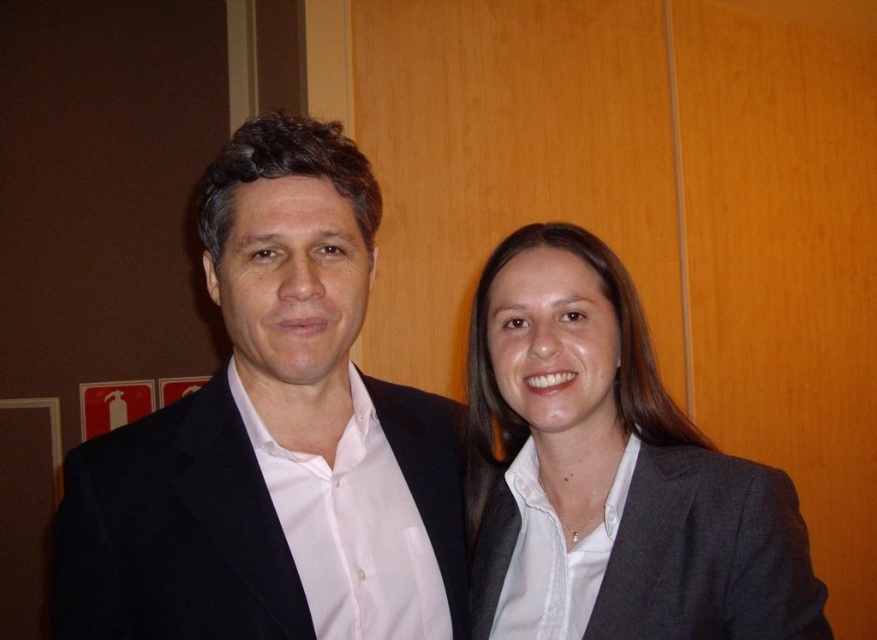
Can you confirm if matte gray blazer at right is bigger than gray fabric business suit at center?

Yes, matte gray blazer at right is bigger than gray fabric business suit at center.

Between point (811, 614) and point (639, 634), which one is positioned behind?

The point (811, 614) is more distant.

You are a GUI agent. You are given a task and a screenshot of the screen. Output one action in this format:
    pyautogui.click(x=<x>, y=<y>)
    Task: Click on the matte gray blazer at right
    Image resolution: width=877 pixels, height=640 pixels.
    Given the screenshot: What is the action you would take?
    pyautogui.click(x=610, y=474)

Between black matte suit at center and matte gray blazer at right, which one is positioned higher?

black matte suit at center

Is black matte suit at center behind matte gray blazer at right?

No, it is in front of matte gray blazer at right.

Measure the distance between black matte suit at center and camera.

black matte suit at center and camera are 30.04 inches apart from each other.

Find the location of a particular element. This screenshot has width=877, height=640. black matte suit at center is located at coordinates (261, 424).

Does black matte suit at center have a greater height compared to gray fabric business suit at center?

Yes.

This screenshot has width=877, height=640. What do you see at coordinates (261, 424) in the screenshot?
I see `black matte suit at center` at bounding box center [261, 424].

Does point (53, 545) come farther from viewer compared to point (740, 609)?

Yes.

What are the coordinates of `black matte suit at center` in the screenshot? It's located at (261, 424).